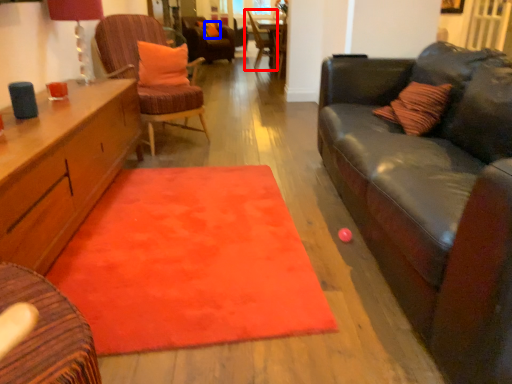
Question: Which object is further to the camera taking this photo, chair (highlighted by a red box) or pillow (highlighted by a blue box)?

Choices:
 (A) chair
 (B) pillow

Answer: (B)